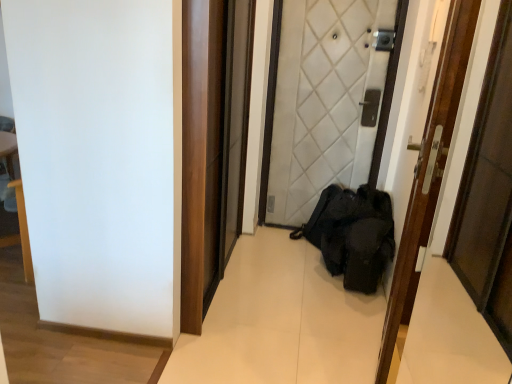
Where is `free spot below wooden door at center, the 1th door in the front-to-back sequence (from a real-world perspective)`? The image size is (512, 384). free spot below wooden door at center, the 1th door in the front-to-back sequence (from a real-world perspective) is located at coordinates (376, 332).